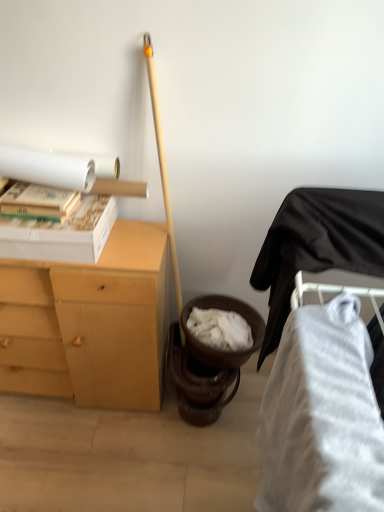
Question: Is white cardboard box at upper left behind light brown wood desk at left?

Choices:
 (A) yes
 (B) no

Answer: (B)

Question: Considering the relative sizes of white cardboard box at upper left and light brown wood desk at left in the image provided, is white cardboard box at upper left shorter than light brown wood desk at left?

Choices:
 (A) no
 (B) yes

Answer: (B)

Question: Is white cardboard box at upper left to the left of light brown wood desk at left from the viewer's perspective?

Choices:
 (A) yes
 (B) no

Answer: (A)

Question: Can you confirm if white cardboard box at upper left is taller than light brown wood desk at left?

Choices:
 (A) no
 (B) yes

Answer: (A)

Question: Does white cardboard box at upper left lie in front of light brown wood desk at left?

Choices:
 (A) no
 (B) yes

Answer: (B)

Question: Is white cardboard box at upper left smaller than light brown wood desk at left?

Choices:
 (A) yes
 (B) no

Answer: (A)

Question: Considering the relative sizes of white cardboard box at upper left and white matte book at upper left in the image provided, is white cardboard box at upper left taller than white matte book at upper left?

Choices:
 (A) no
 (B) yes

Answer: (B)

Question: From the image's perspective, is white cardboard box at upper left below white matte book at upper left?

Choices:
 (A) no
 (B) yes

Answer: (B)

Question: Is white cardboard box at upper left surrounding white matte book at upper left?

Choices:
 (A) no
 (B) yes

Answer: (B)

Question: Is white cardboard box at upper left oriented towards white matte book at upper left?

Choices:
 (A) no
 (B) yes

Answer: (A)

Question: Is white cardboard box at upper left shorter than white matte book at upper left?

Choices:
 (A) yes
 (B) no

Answer: (B)

Question: Considering the relative positions of white cardboard box at upper left and white matte book at upper left in the image provided, is white cardboard box at upper left to the right of white matte book at upper left from the viewer's perspective?

Choices:
 (A) no
 (B) yes

Answer: (A)

Question: Can you confirm if white matte book at upper left is taller than light brown wood desk at left?

Choices:
 (A) no
 (B) yes

Answer: (A)